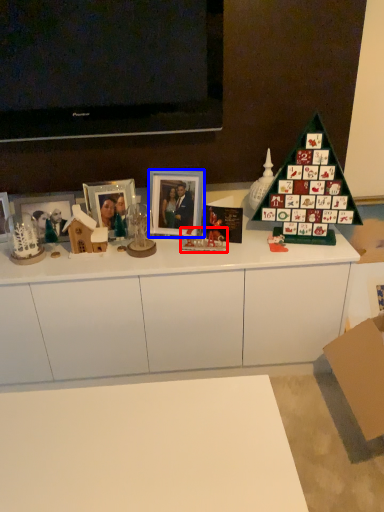
Question: Among these objects, which one is nearest to the camera, toy (highlighted by a red box) or picture frame (highlighted by a blue box)?

Choices:
 (A) toy
 (B) picture frame

Answer: (A)